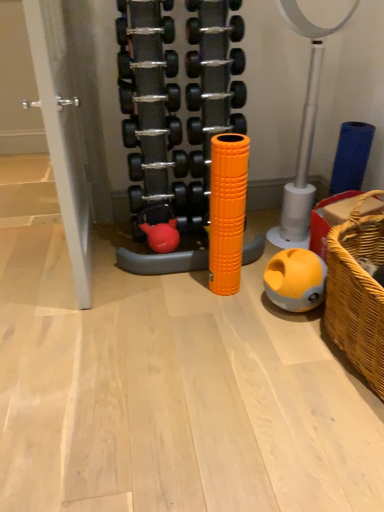
Question: Can you confirm if yellow matte ball at lower right, positioned as the third toy in top-to-bottom order, is positioned to the left of rubberized red dumbbell at center, which ranks as the 2th toy in bottom-to-top order?

Choices:
 (A) yes
 (B) no

Answer: (B)

Question: Is yellow matte ball at lower right, positioned as the third toy in top-to-bottom order, positioned beyond the bounds of rubberized red dumbbell at center, placed as the 2th toy when sorted from top to bottom?

Choices:
 (A) yes
 (B) no

Answer: (A)

Question: Is yellow matte ball at lower right, the 1th toy ordered from the bottom, smaller than rubberized red dumbbell at center, which ranks as the 2th toy in bottom-to-top order?

Choices:
 (A) yes
 (B) no

Answer: (B)

Question: Does yellow matte ball at lower right, the 1th toy ordered from the bottom, have a lesser height compared to rubberized red dumbbell at center, placed as the 2th toy when sorted from top to bottom?

Choices:
 (A) no
 (B) yes

Answer: (A)

Question: Considering the relative sizes of yellow matte ball at lower right, the 1th toy ordered from the bottom, and rubberized red dumbbell at center, which ranks as the 2th toy in bottom-to-top order, in the image provided, is yellow matte ball at lower right, the 1th toy ordered from the bottom, thinner than rubberized red dumbbell at center, which ranks as the 2th toy in bottom-to-top order,?

Choices:
 (A) no
 (B) yes

Answer: (A)

Question: Is yellow matte ball at lower right, positioned as the third toy in top-to-bottom order, far away from rubberized red dumbbell at center, placed as the 2th toy when sorted from top to bottom?

Choices:
 (A) no
 (B) yes

Answer: (A)

Question: Is rubberized red dumbbell at center, which ranks as the 2th toy in bottom-to-top order, positioned behind woven brown basket at lower right?

Choices:
 (A) no
 (B) yes

Answer: (B)

Question: Is rubberized red dumbbell at center, which ranks as the 2th toy in bottom-to-top order, looking in the opposite direction of woven brown basket at lower right?

Choices:
 (A) no
 (B) yes

Answer: (A)

Question: Does rubberized red dumbbell at center, placed as the 2th toy when sorted from top to bottom, appear on the left side of woven brown basket at lower right?

Choices:
 (A) yes
 (B) no

Answer: (A)

Question: Can we say rubberized red dumbbell at center, placed as the 2th toy when sorted from top to bottom, lies outside woven brown basket at lower right?

Choices:
 (A) yes
 (B) no

Answer: (A)

Question: Is rubberized red dumbbell at center, which ranks as the 2th toy in bottom-to-top order, oriented towards woven brown basket at lower right?

Choices:
 (A) yes
 (B) no

Answer: (B)

Question: Does rubberized red dumbbell at center, which ranks as the 2th toy in bottom-to-top order, have a greater height compared to woven brown basket at lower right?

Choices:
 (A) no
 (B) yes

Answer: (A)

Question: Is rubberized red dumbbell at center, which ranks as the 2th toy in bottom-to-top order, thinner than orange rubber foam roller at center, the third toy in the bottom-to-top sequence?

Choices:
 (A) no
 (B) yes

Answer: (B)